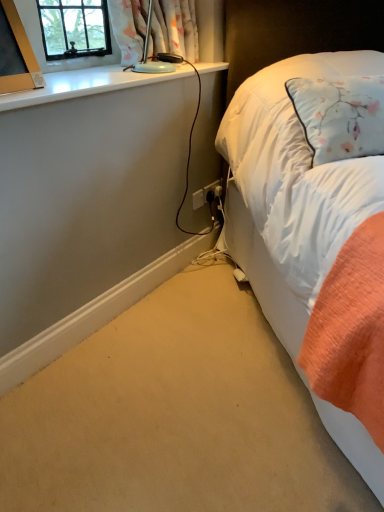
Question: From a real-world perspective, is floral fabric curtain at upper left above or below white plastic power plugs and sockets at lower center, which appears as the 2th power plugs and sockets when viewed from the right?

Choices:
 (A) above
 (B) below

Answer: (A)

Question: Considering the positions of floral fabric curtain at upper left and white plastic power plugs and sockets at lower center, which appears as the 2th power plugs and sockets when viewed from the right, in the image, is floral fabric curtain at upper left taller or shorter than white plastic power plugs and sockets at lower center, which appears as the 2th power plugs and sockets when viewed from the right,?

Choices:
 (A) short
 (B) tall

Answer: (B)

Question: Considering the real-world distances, which object is closest to the white glossy window sill at upper left?

Choices:
 (A) black plastic power plugs and sockets at lower right, the 2th power plugs and sockets when ordered from left to right
 (B) white soft bed at right
 (C) white plastic power plugs and sockets at lower center, which appears as the 2th power plugs and sockets when viewed from the right
 (D) matte gold picture frame at upper left
 (E) floral fabric curtain at upper left

Answer: (D)

Question: Which object is positioned closest to the black plastic power plugs and sockets at lower right, acting as the 1th power plugs and sockets starting from the right?

Choices:
 (A) white soft bed at right
 (B) floral fabric curtain at upper left
 (C) matte gold picture frame at upper left
 (D) white glossy window sill at upper left
 (E) white plastic power plugs and sockets at lower center, which appears as the 2th power plugs and sockets when viewed from the right

Answer: (E)